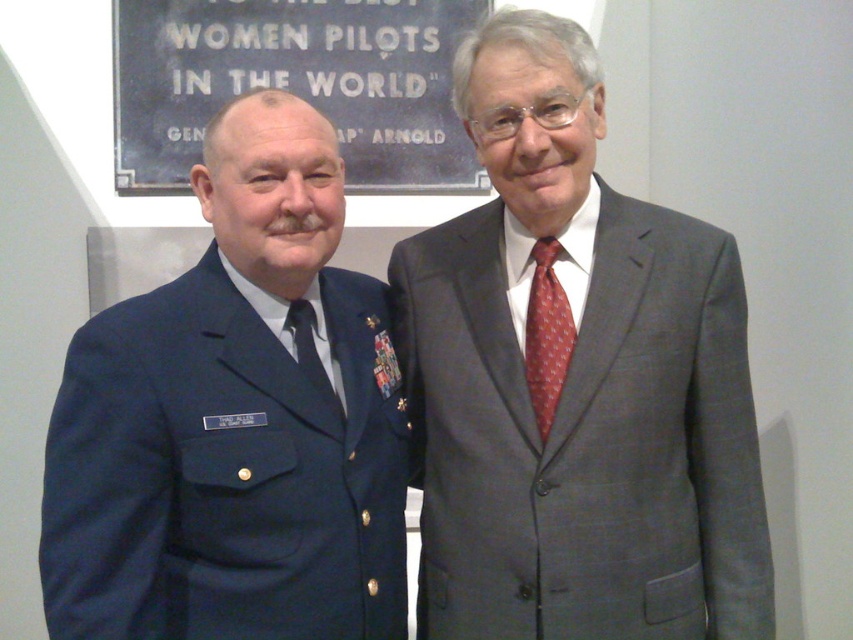
Between gray suit at center and black stone plaque at upper center, which one appears on the right side from the viewer's perspective?

gray suit at center is more to the right.

Can you confirm if gray suit at center is positioned to the right of black stone plaque at upper center?

Yes, gray suit at center is to the right of black stone plaque at upper center.

Locate an element on the screen. This screenshot has width=853, height=640. gray suit at center is located at coordinates (576, 381).

Does gray suit at center have a larger size compared to black silk tie at center?

Indeed, gray suit at center has a larger size compared to black silk tie at center.

Which is in front, point (699, 440) or point (311, 364)?

Point (311, 364) is in front.

Identify the location of gray suit at center. This screenshot has width=853, height=640. (576, 381).

Can you confirm if black stone plaque at upper center is positioned to the right of black silk tie at center?

No, black stone plaque at upper center is not to the right of black silk tie at center.

Who is more distant from viewer, (285, 3) or (321, 380)?

The point (285, 3) is behind.

Where is `black stone plaque at upper center`? black stone plaque at upper center is located at coordinates (294, 84).